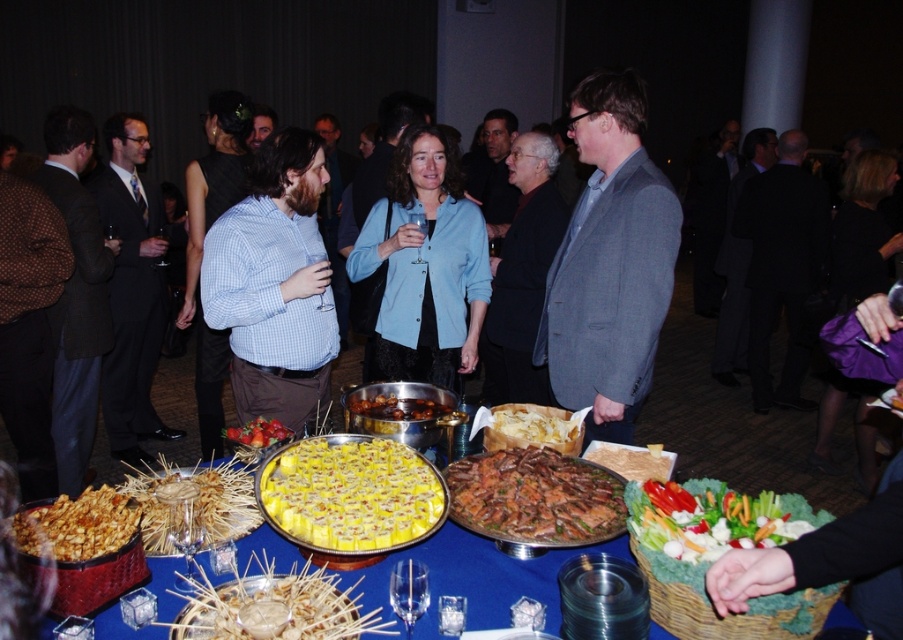
Between blue checkered shirt at center and fresh red strawberries at center, which one has less height?

fresh red strawberries at center

Looking at this image, is blue checkered shirt at center smaller than fresh red strawberries at center?

Incorrect, blue checkered shirt at center is not smaller in size than fresh red strawberries at center.

Is point (291, 381) positioned before point (250, 433)?

No, it is behind (250, 433).

Locate an element on the screen. This screenshot has height=640, width=903. blue checkered shirt at center is located at coordinates (275, 284).

Can you confirm if dark gray suit at left is positioned to the right of wooden skewers at center?

In fact, dark gray suit at left is to the left of wooden skewers at center.

Between dark gray suit at left and wooden skewers at center, which one is positioned higher?

dark gray suit at left

Does point (114, 184) lie behind point (391, 557)?

Yes, it is.

Locate an element on the screen. dark gray suit at left is located at coordinates (132, 291).

How much distance is there between dark gray suit at left and toasted bread at center?

dark gray suit at left and toasted bread at center are 2.19 meters apart.

Identify the location of dark gray suit at left. This screenshot has width=903, height=640. (132, 291).